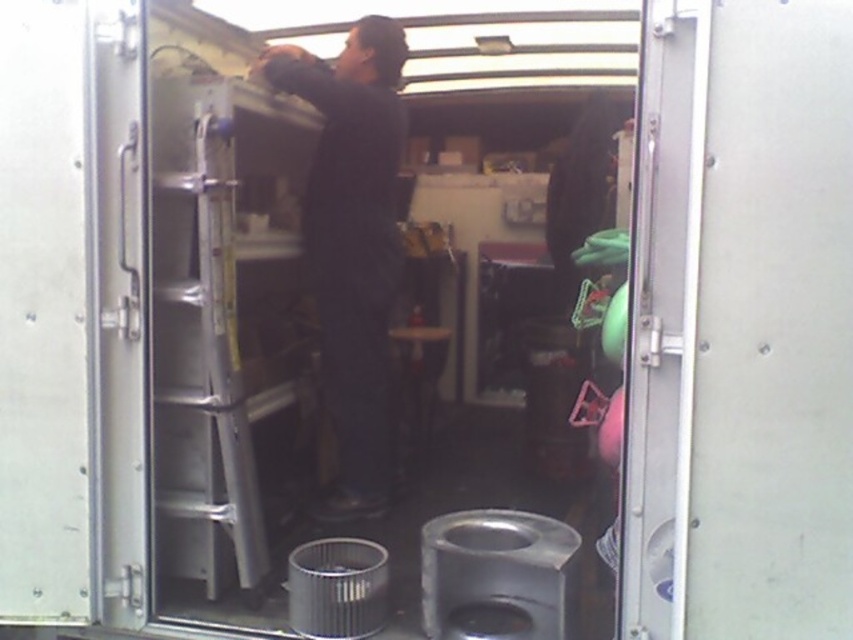
Question: Can you confirm if silver metallic ladder at center is bigger than metallic silver door at center?

Choices:
 (A) yes
 (B) no

Answer: (A)

Question: Does metallic silver door at center appear over dark matte clothing at upper center?

Choices:
 (A) no
 (B) yes

Answer: (A)

Question: Estimate the real-world distances between objects in this image. Which object is farther from the dark matte clothing at upper center?

Choices:
 (A) metallic silver door at center
 (B) silver metallic ladder at center

Answer: (A)

Question: Estimate the real-world distances between objects in this image. Which object is farther from the silver metallic ladder at center?

Choices:
 (A) dark matte clothing at upper center
 (B) metallic silver door at center

Answer: (B)

Question: Which is farther from the silver metallic ladder at center?

Choices:
 (A) metallic silver door at center
 (B) dark matte clothing at upper center

Answer: (A)

Question: Does silver metallic ladder at center appear over dark matte clothing at upper center?

Choices:
 (A) no
 (B) yes

Answer: (A)